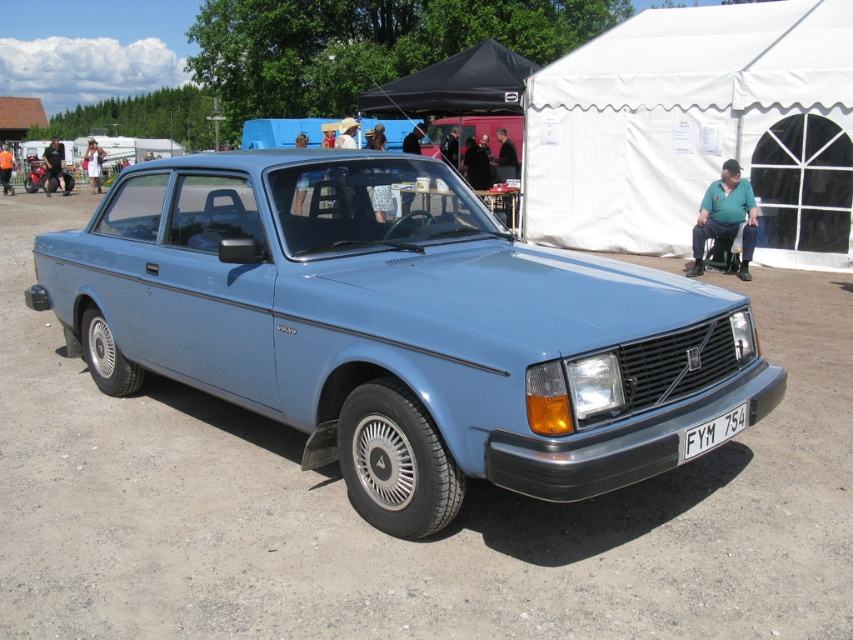
You are a photographer trying to capture the light blue matte car at center and the white plastic license plate at front in a single shot. Based on their positions, will the license plate be visible in the photo if you focus on the car?

The light blue matte car at center is above the white plastic license plate at front, so if you focus on the car, the license plate will still be visible in the photo as it is positioned below the car.